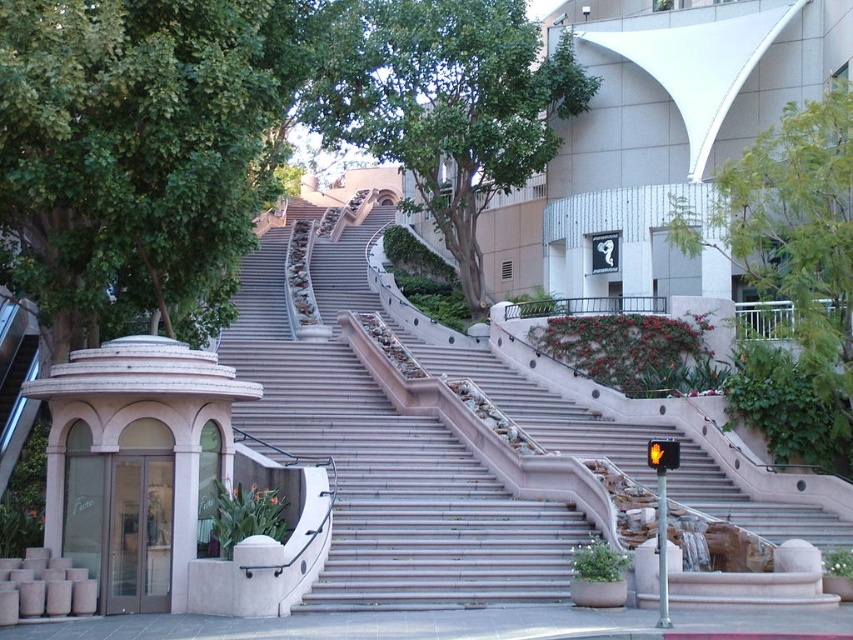
Does smooth concrete stairs at center have a lesser width compared to green leafy tree at upper center?

In fact, smooth concrete stairs at center might be wider than green leafy tree at upper center.

Which is above, smooth concrete stairs at center or green leafy tree at upper center?

green leafy tree at upper center is higher up.

Where is `smooth concrete stairs at center`? smooth concrete stairs at center is located at coordinates (386, 458).

The height and width of the screenshot is (640, 853). I want to click on smooth concrete stairs at center, so click(x=386, y=458).

Is point (193, 116) positioned before point (532, 504)?

Yes, point (193, 116) is closer to viewer.

Is green leafy tree at left to the right of smooth concrete stairs at center from the viewer's perspective?

No, green leafy tree at left is not to the right of smooth concrete stairs at center.

Find the location of `green leafy tree at left`. green leafy tree at left is located at coordinates (135, 156).

Between green leafy tree at center and green leafy tree at upper center, which one appears on the right side from the viewer's perspective?

green leafy tree at upper center

Can you confirm if green leafy tree at center is positioned to the left of green leafy tree at upper center?

Correct, you'll find green leafy tree at center to the left of green leafy tree at upper center.

This screenshot has height=640, width=853. Identify the location of green leafy tree at center. (444, 104).

Locate an element on the screen. The height and width of the screenshot is (640, 853). green leafy tree at center is located at coordinates (444, 104).